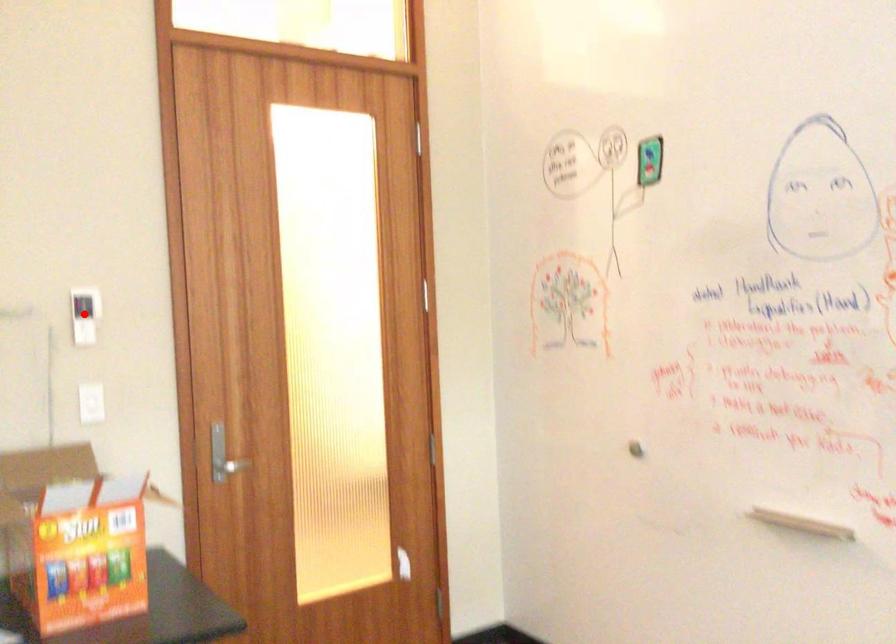
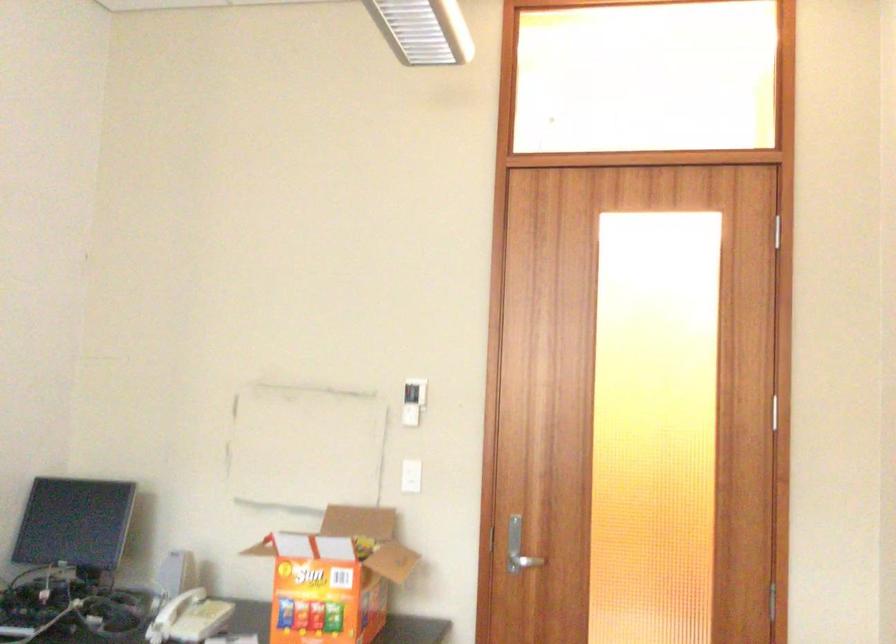
Question: I am providing you with two images of the same scene from different viewpoints. A red point is shown in image1. For the corresponding object point in image2, is it positioned nearer or farther from the camera?

Choices:
 (A) Nearer
 (B) Farther

Answer: (B)